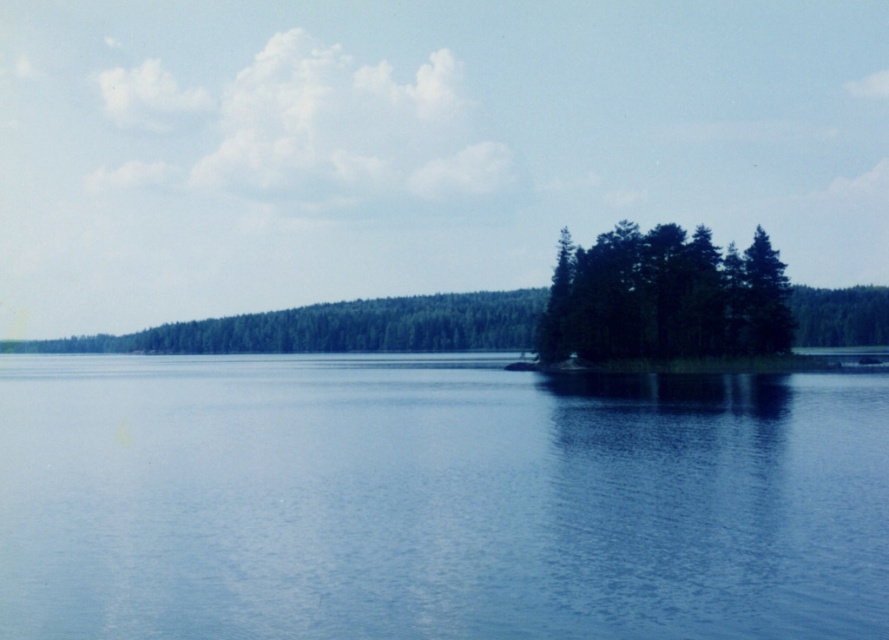
Question: Among these objects, which one is nearest to the camera?

Choices:
 (A) blue smooth water at center
 (B) green matte trees at center
 (C) green matte tree at right

Answer: (A)

Question: Does blue smooth water at center appear on the left side of green matte tree at right?

Choices:
 (A) no
 (B) yes

Answer: (B)

Question: Among these objects, which one is farthest from the camera?

Choices:
 (A) green matte tree at right
 (B) blue smooth water at center
 (C) green matte trees at center

Answer: (A)

Question: Can you confirm if blue smooth water at center is positioned to the right of green matte trees at center?

Choices:
 (A) yes
 (B) no

Answer: (B)

Question: Which point appears farthest from the camera in this image?

Choices:
 (A) (757, 556)
 (B) (857, 285)
 (C) (755, 291)

Answer: (B)

Question: Does blue smooth water at center have a smaller size compared to green matte tree at right?

Choices:
 (A) yes
 (B) no

Answer: (A)